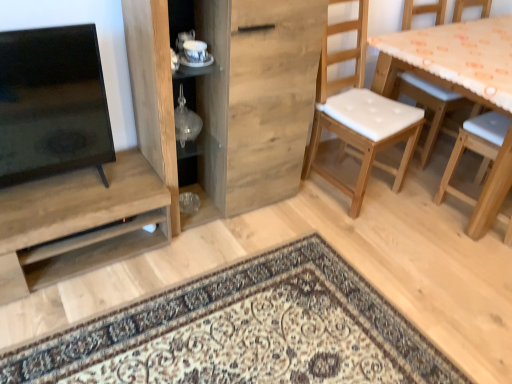
You are a GUI agent. You are given a task and a screenshot of the screen. Output one action in this format:
    pyautogui.click(x=<x>, y=<y>)
    Task: Click on the empty space that is ontop of matte wood shelf at left, arranged as the 2th shelf when viewed from the top (from a real-world perspective)
    
    Given the screenshot: What is the action you would take?
    pyautogui.click(x=62, y=194)